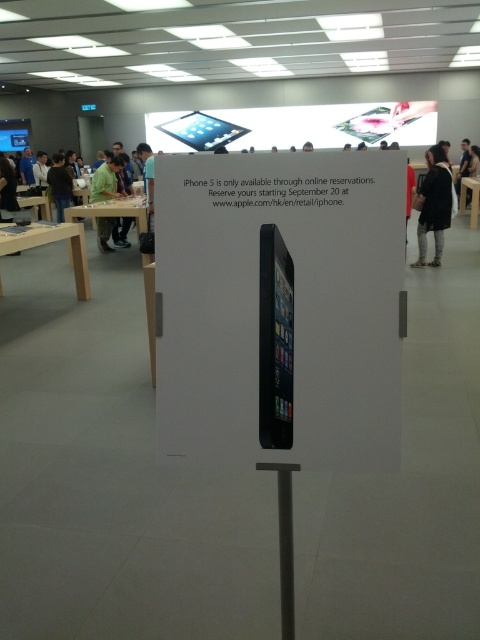
Is black fabric at upper right to the left of green fabric shirt at center from the viewer's perspective?

In fact, black fabric at upper right is to the right of green fabric shirt at center.

What are the coordinates of `black fabric at upper right` in the screenshot? It's located at (433, 204).

The height and width of the screenshot is (640, 480). What are the coordinates of `black fabric at upper right` in the screenshot? It's located at (433, 204).

Can you confirm if black fabric at upper right is taller than dark brown leather jacket at upper left?

Correct, black fabric at upper right is much taller as dark brown leather jacket at upper left.

Image resolution: width=480 pixels, height=640 pixels. What are the coordinates of `black fabric at upper right` in the screenshot? It's located at (433, 204).

What do you see at coordinates (107, 180) in the screenshot?
I see `green fabric shirt at center` at bounding box center [107, 180].

Is green fabric shirt at center to the left of dark brown leather jacket at upper left from the viewer's perspective?

Incorrect, green fabric shirt at center is not on the left side of dark brown leather jacket at upper left.

Which is behind, point (117, 164) or point (60, 164)?

The point (60, 164) is more distant.

I want to click on green fabric shirt at center, so click(107, 180).